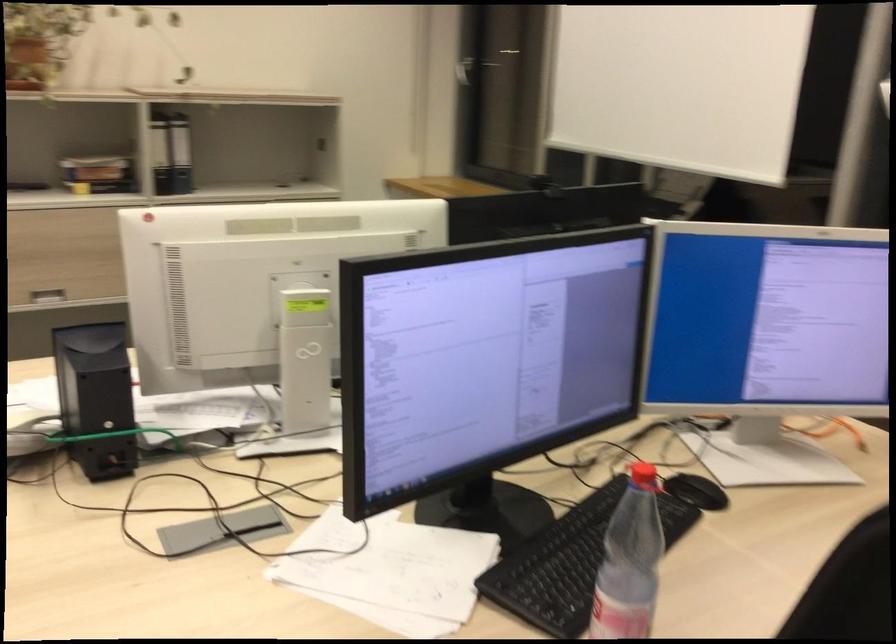
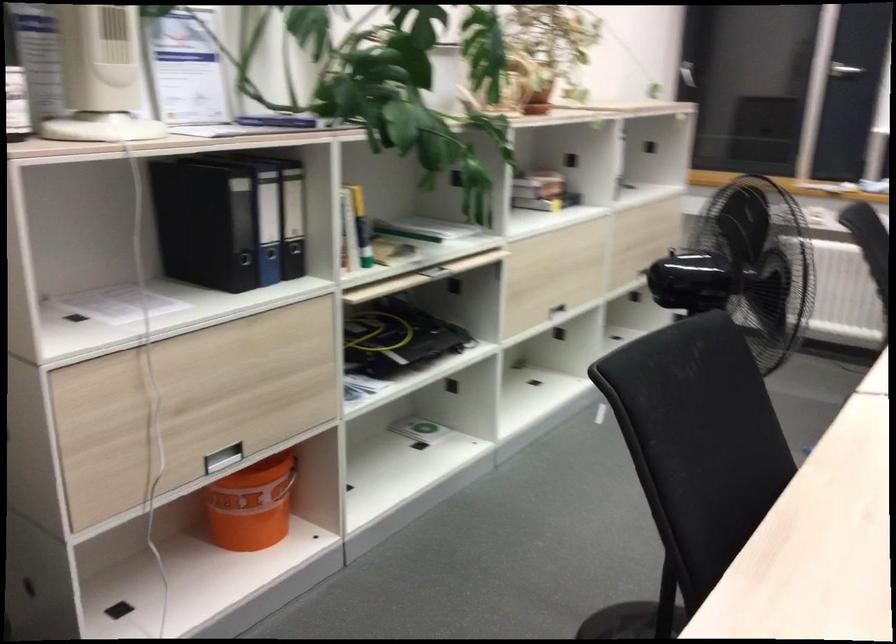
Question: In a continuous first-person perspective shot, in which direction is the camera moving?

Choices:
 (A) Left
 (B) Right
 (C) Forward
 (D) Backward

Answer: (A)